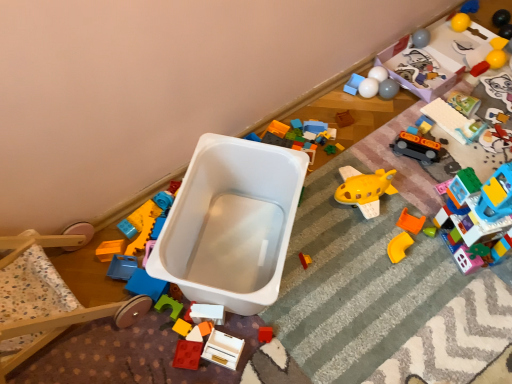
This screenshot has height=384, width=512. I want to click on vacant area that lies between matte gray cat at upper right, acting as the 2th toy starting from the right, and orange matte plastic corner piece at lower right, the ninth toy positioned from the right, so click(x=463, y=155).